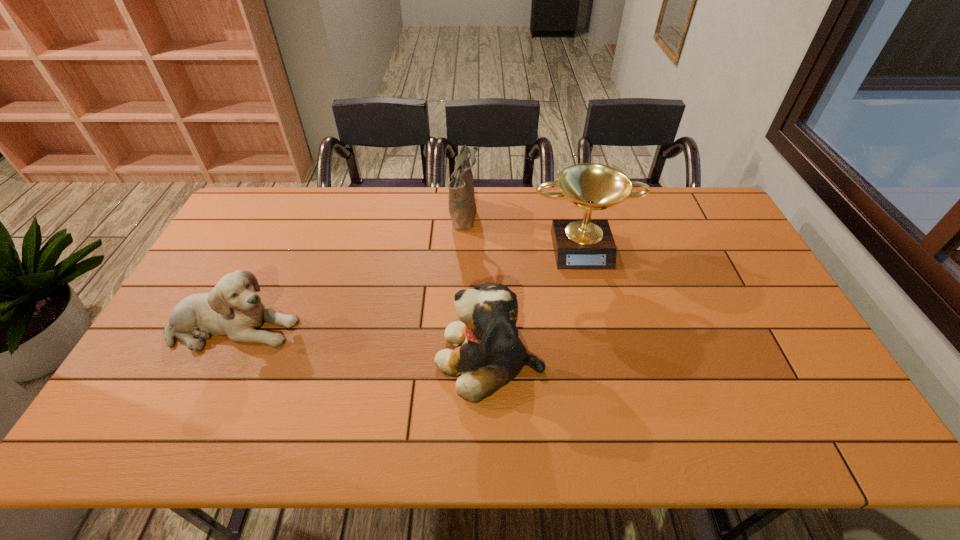
Identify which object is located as the third nearest to the right puppy. Please provide its 2D coordinates. Your answer should be formatted as a tuple, i.e. [(x, y)], where the tuple contains the x and y coordinates of a point satisfying the conditions above.

[(233, 308)]

Identify which object is the third nearest to the shoulder bag. Please provide its 2D coordinates. Your answer should be formatted as a tuple, i.e. [(x, y)], where the tuple contains the x and y coordinates of a point satisfying the conditions above.

[(233, 308)]

What are the coordinates of `vacant area that satisfies the following two spatial constraints: 1. on the front-facing side of the rightmost object; 2. at the face of the right puppy` in the screenshot? It's located at (x=609, y=359).

The height and width of the screenshot is (540, 960). In order to click on vacant point that satisfies the following two spatial constraints: 1. on the front-facing side of the rightmost object; 2. on the front-facing side of the left puppy in this screenshot , I will do `click(602, 327)`.